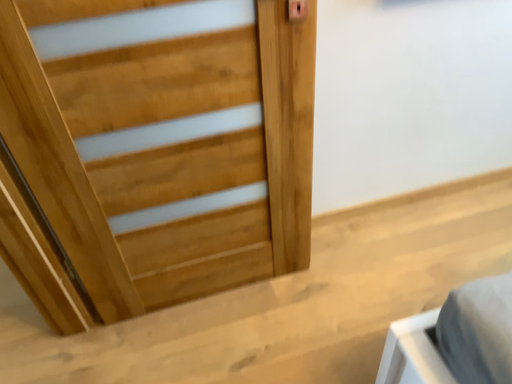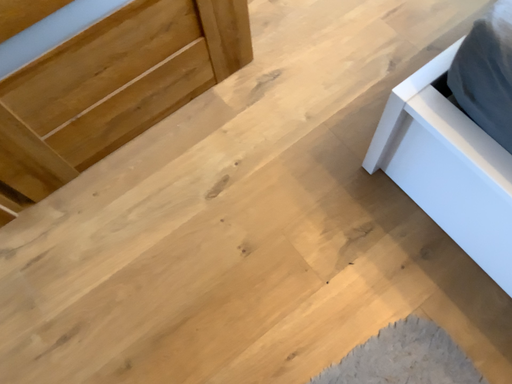
Question: Which way did the camera rotate in the video?

Choices:
 (A) rotated left
 (B) rotated right

Answer: (B)